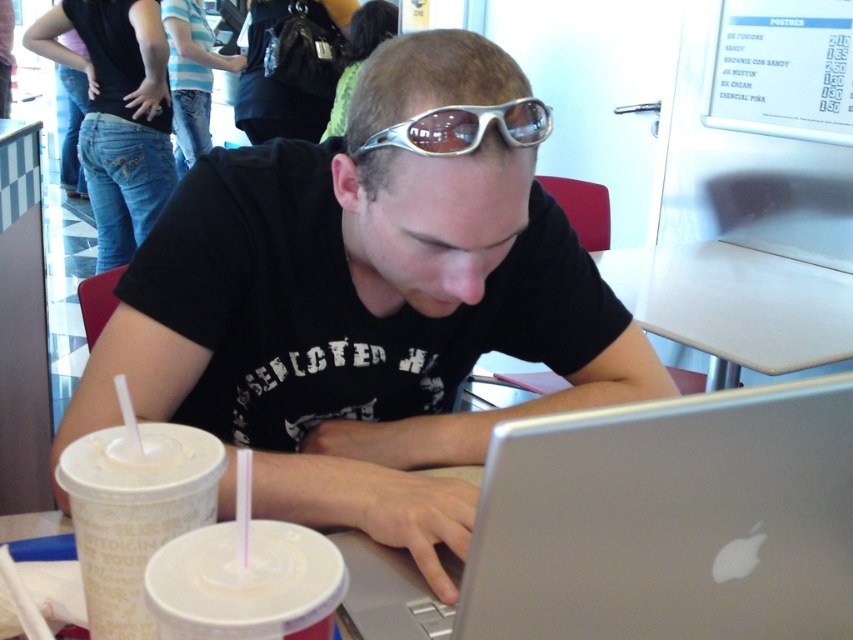
You are a barista trying to place two cups on a tray. The white frosted cup at lower left and the white matte cup at lower center are on the table. Which cup should you pick up first to avoid knocking over the other?

You should pick up the white frosted cup at lower left first because it is located above the white matte cup at lower center, so moving it first would prevent disturbing the lower cup.

In the scene shown: You are a customer at this table and want to place your phone between the white frosted cup at lower left and the white matte cup at lower center. Can you fit your phone there?

The white frosted cup at lower left is narrower than the white matte cup at lower center, so the space between them may be sufficient to fit your phone depending on the phone size. However, since the exact distance between the cups isn